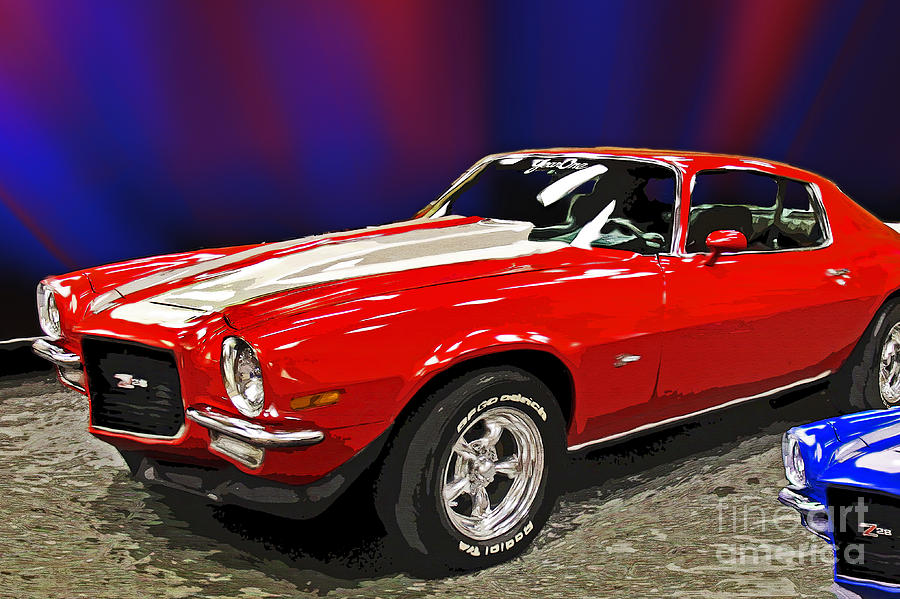
What are the coordinates of `glare from light` in the screenshot? It's located at (600, 223), (571, 178), (596, 265), (870, 435), (892, 465), (358, 323), (397, 307), (483, 305), (211, 254).